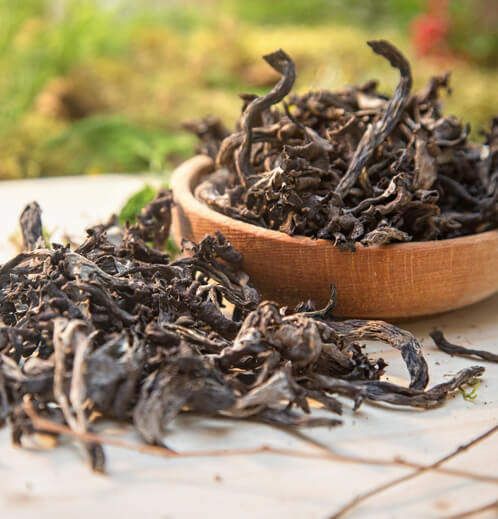
Locate an element on the screen. bowl is located at coordinates (299, 273).